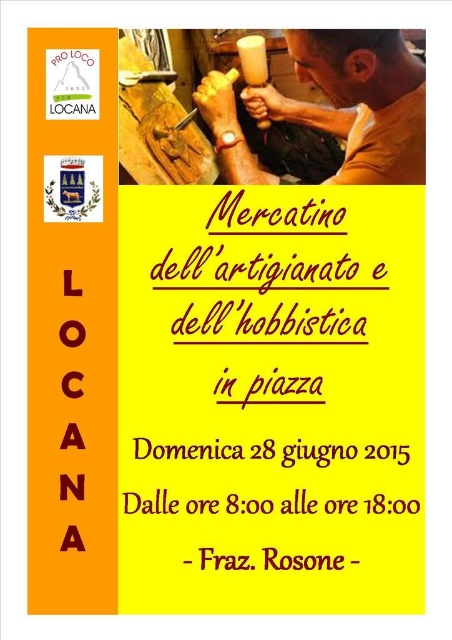
Question: Does matte brown wood at upper center come in front of matte yellow cup at upper center?

Choices:
 (A) no
 (B) yes

Answer: (B)

Question: Is matte brown wood at upper center to the right of matte yellow cup at upper center from the viewer's perspective?

Choices:
 (A) no
 (B) yes

Answer: (B)

Question: Which of the following is the closest to the observer?

Choices:
 (A) (244, 60)
 (B) (252, 170)

Answer: (B)

Question: Which object is closer to the camera taking this photo?

Choices:
 (A) matte yellow cup at upper center
 (B) matte brown wood at upper center

Answer: (B)

Question: Does matte brown wood at upper center appear on the left side of matte yellow cup at upper center?

Choices:
 (A) yes
 (B) no

Answer: (B)